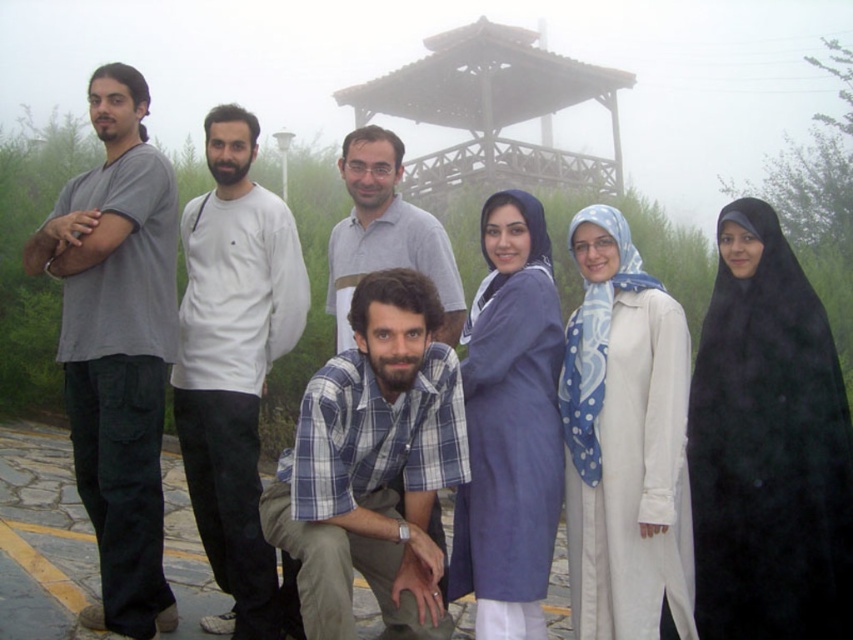
You are standing at the position of the matte gray shirt at center and want to walk towards the wooden gazebo at upper center. Which direction should you move?

The wooden gazebo at upper center is to the right of the matte gray shirt at center, so you should move to your right to reach it.

You are standing at the center of the image and want to hand a note to both the person wearing the white cotton shirt at center and the matte gray shirt at center. If you can reach up to 20 feet, will you be able to hand the note to both without moving from your current position?

The white cotton shirt at center is 19.77 feet away from matte gray shirt at center. Since you can reach up to 20 feet, you can hand the note to both the white cotton shirt at center and the matte gray shirt at center without moving from your current position because the distance between them is within your reach limit.